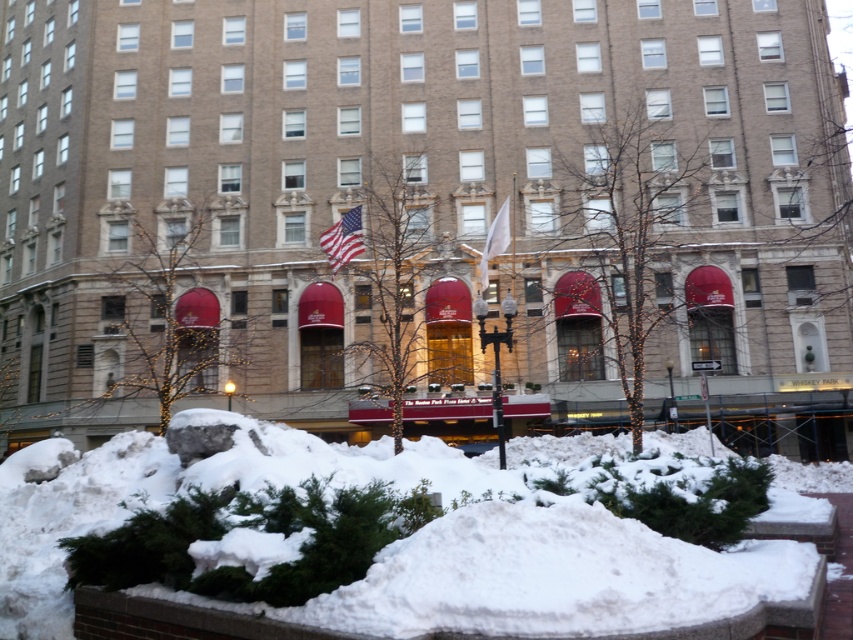
You are standing at the origin point in the image. The brown brick building at center is located at coordinates. What are its coordinates?

The brown brick building at center is located at coordinates point (x=426, y=212).

You are standing in front of the building and see the american flag at center and the white fabric flag at center. Which flag is positioned more to the left?

The american flag at center is positioned more to the left than the white fabric flag at center.

You are a photographer standing in front of the building. You want to capture both the white fluffy snow at lower center and the white fabric flag at center in your shot. Which object will appear bigger in the photo?

The white fluffy snow at lower center will appear bigger in the photo because it is larger in size than the white fabric flag at center.